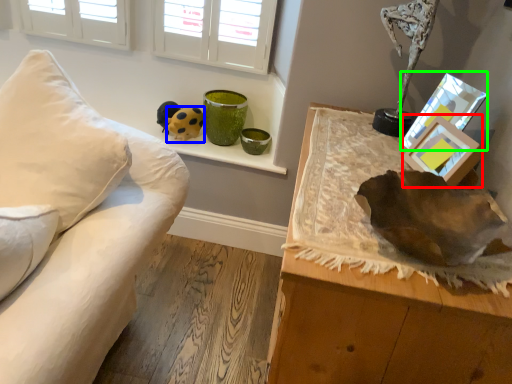
Question: Based on their relative distances, which object is farther from picture frame (highlighted by a red box)? Choose from toy (highlighted by a blue box) and picture frame (highlighted by a green box).

Choices:
 (A) toy
 (B) picture frame

Answer: (A)